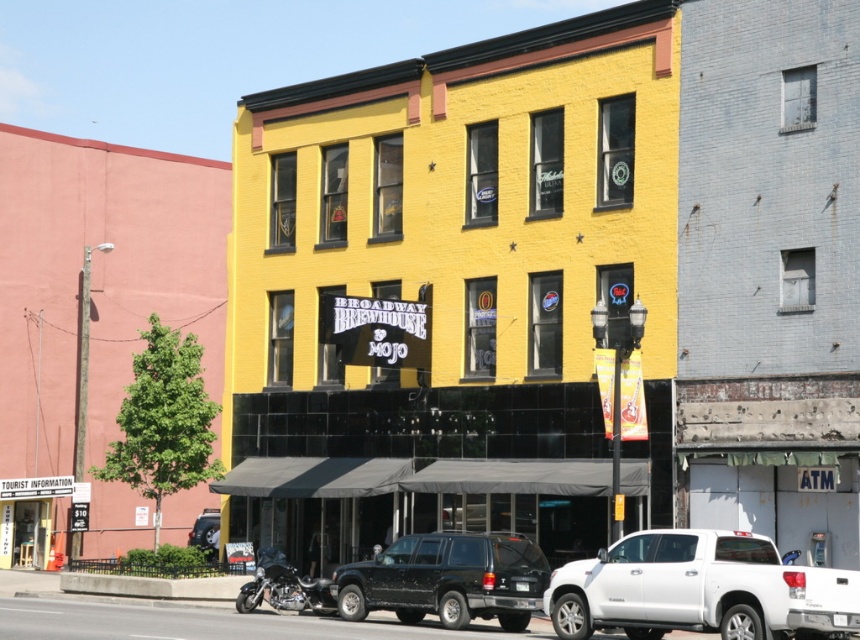
Question: Which object appears closest to the camera in this image?

Choices:
 (A) white matte pickup truck at lower right
 (B) metallic silver motorcycle at lower left
 (C) black matte suv at center

Answer: (A)

Question: Observing the image, what is the correct spatial positioning of white matte pickup truck at lower right in reference to shiny chrome motorcycle at lower left?

Choices:
 (A) above
 (B) below

Answer: (A)

Question: Is black matte suv at center to the left of metallic silver motorcycle at lower left from the viewer's perspective?

Choices:
 (A) yes
 (B) no

Answer: (B)

Question: Is black matte suv at center closer to the viewer compared to metallic silver motorcycle at lower left?

Choices:
 (A) yes
 (B) no

Answer: (A)

Question: Among these points, which one is farthest from the camera?

Choices:
 (A) (301, 600)
 (B) (207, 544)
 (C) (513, 595)
 (D) (624, 600)

Answer: (B)

Question: Which object is closer to the camera taking this photo?

Choices:
 (A) metallic silver motorcycle at lower left
 (B) black matte suv at center
 (C) white matte pickup truck at lower right
 (D) shiny chrome motorcycle at lower left

Answer: (C)